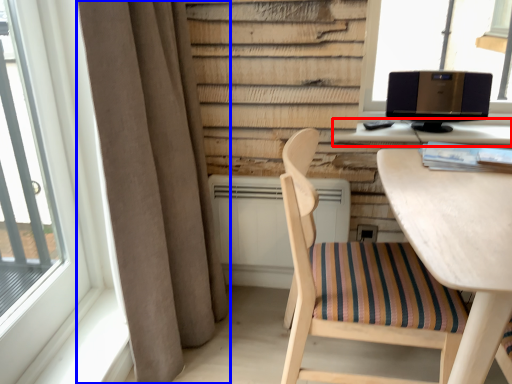
Question: Which point is further to the camera, computer (highlighted by a red box) or curtain (highlighted by a blue box)?

Choices:
 (A) computer
 (B) curtain

Answer: (A)